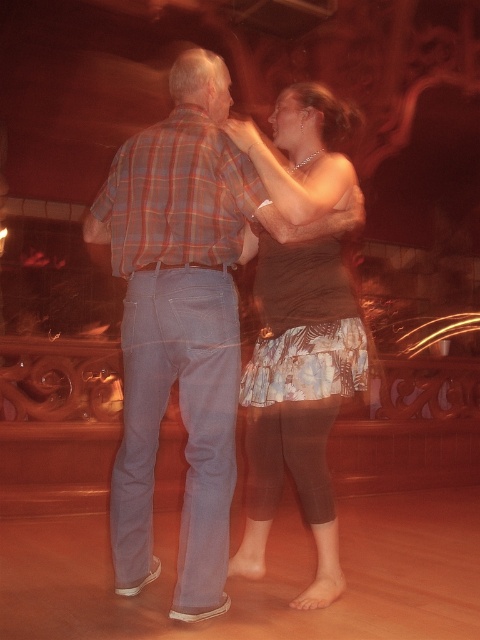
Who is positioned more to the left, matte brown blouse at center or plaid fabric shirt at upper center?

Positioned to the left is plaid fabric shirt at upper center.

What do you see at coordinates (297, 403) in the screenshot? The image size is (480, 640). I see `matte brown blouse at center` at bounding box center [297, 403].

Image resolution: width=480 pixels, height=640 pixels. Find the location of `matte brown blouse at center`. matte brown blouse at center is located at coordinates (297, 403).

In the scene shown: Is the position of plaid shirt at center less distant than that of matte brown blouse at center?

Yes, plaid shirt at center is closer to the viewer.

This screenshot has width=480, height=640. I want to click on plaid shirt at center, so coord(184,320).

In order to click on plaid shirt at center in this screenshot , I will do `click(184, 320)`.

The width and height of the screenshot is (480, 640). I want to click on plaid shirt at center, so click(x=184, y=320).

Who is lower down, plaid shirt at center or plaid fabric shirt at upper center?

plaid shirt at center is below.

Between point (192, 129) and point (99, 198), which one is positioned in front?

Point (192, 129) is more forward.

Is point (172, 68) positioned in front of point (140, 177)?

That is False.

Where is `plaid shirt at center`? plaid shirt at center is located at coordinates pyautogui.click(x=184, y=320).